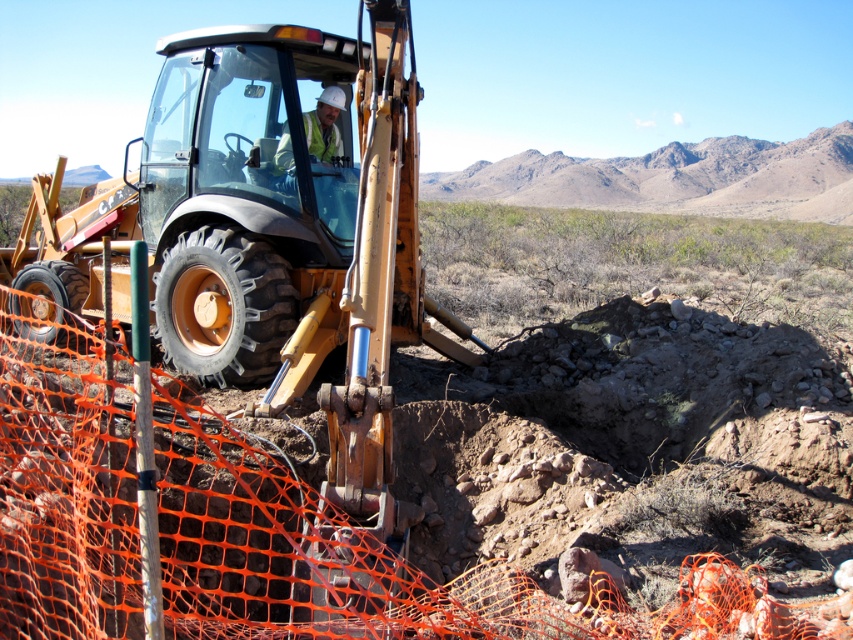
Who is lower down, metallic yellow tractor at center or white hard hat at center?

metallic yellow tractor at center is lower down.

Image resolution: width=853 pixels, height=640 pixels. What are the coordinates of `metallic yellow tractor at center` in the screenshot? It's located at (222, 356).